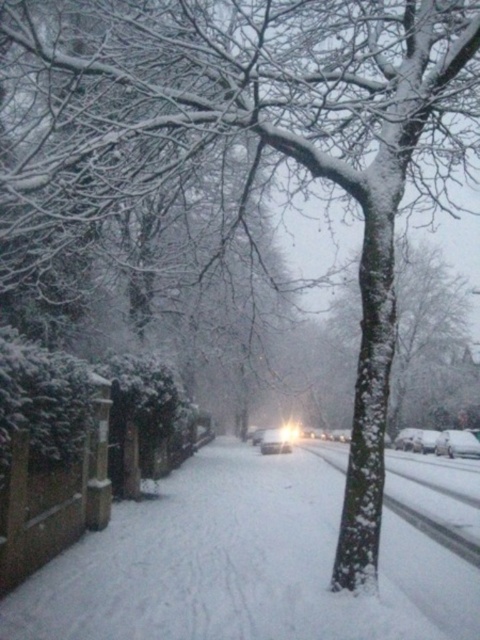
You are a delivery driver who needs to drive through the snow on the street. The white fluffy snow at center and the white matte car at center are both in your path. Which one of these two objects is wider, making it potentially more challenging for your vehicle to navigate around?

The white fluffy snow at center is wider than the white matte car at center, so it may be more challenging to navigate around the white fluffy snow at center.

You are standing on the snow covered street and want to walk towards the distant car headlights. Which point, point (311, 579) or point (264, 451), is closer to you as you start walking?

Point (311, 579) is closer to the camera than point (264, 451), so it is closer to you as you start walking.

You are a delivery driver who needs to drive through the snow. You see the white fluffy snow at center and the white glossy car at center in the image. Which one is higher in height?

The white fluffy snow at center is much taller than the white glossy car at center.